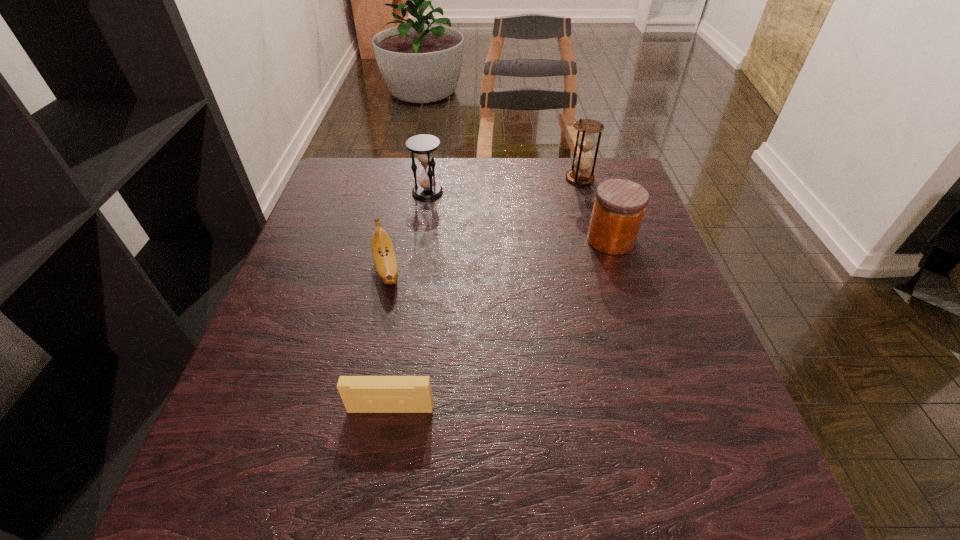
Where is `vacant region between the banana and the jar`? The image size is (960, 540). vacant region between the banana and the jar is located at coordinates (498, 255).

In order to click on vacant space that's between the banana and the right hourglass in this screenshot , I will do `click(483, 225)`.

In order to click on free spot between the jar and the banana in this screenshot , I will do `click(498, 255)`.

Where is `vacant space in between the jar and the nearest object`? Image resolution: width=960 pixels, height=540 pixels. vacant space in between the jar and the nearest object is located at coordinates (500, 325).

Where is `empty location between the left hourglass and the jar`? This screenshot has height=540, width=960. empty location between the left hourglass and the jar is located at coordinates (x=519, y=216).

You are a GUI agent. You are given a task and a screenshot of the screen. Output one action in this format:
    pyautogui.click(x=<x>, y=<y>)
    Task: Click on the vacant area between the right hourglass and the left hourglass
    
    Given the screenshot: What is the action you would take?
    pyautogui.click(x=504, y=185)

At what (x,y) coordinates should I click in order to perform the action: click on blank region between the banana and the videotape. Please return your answer as a coordinate pair (x, y). Looking at the image, I should click on (389, 340).

Identify the location of empty location between the left hourglass and the right hourglass. The width and height of the screenshot is (960, 540). (504, 185).

At what (x,y) coordinates should I click in order to perform the action: click on object that is the closest to the jar. Please return your answer as a coordinate pair (x, y). The height and width of the screenshot is (540, 960). Looking at the image, I should click on (586, 141).

Where is `object that can be found as the second closest to the nearest object`? The image size is (960, 540). object that can be found as the second closest to the nearest object is located at coordinates (619, 206).